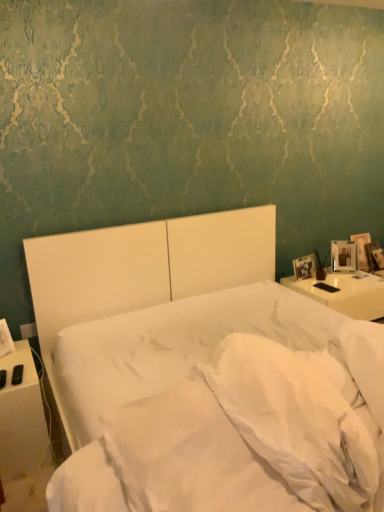
Question: Considering the positions of white matte bed at center and white soft pillow at center, marked as the 2th pillow in a right-to-left arrangement, in the image, is white matte bed at center taller or shorter than white soft pillow at center, marked as the 2th pillow in a right-to-left arrangement,?

Choices:
 (A) tall
 (B) short

Answer: (A)

Question: Considering their positions, is white matte bed at center located in front of or behind white soft pillow at center, marked as the 2th pillow in a right-to-left arrangement?

Choices:
 (A) behind
 (B) front

Answer: (B)

Question: Estimate the real-world distances between objects in this image. Which object is closer to the white plastic remote at left, the first nightstand from the left?

Choices:
 (A) white soft pillow at lower right, arranged as the second pillow when viewed from the left
 (B) white soft pillow at center, marked as the 2th pillow in a right-to-left arrangement
 (C) white glossy nightstand at right, placed as the 2th nightstand when sorted from left to right
 (D) white matte bed at center

Answer: (D)

Question: Based on their relative distances, which object is nearer to the white plastic remote at left, positioned as the 1th nightstand in front-to-back order?

Choices:
 (A) white soft pillow at center, marked as the first pillow in a left-to-right arrangement
 (B) white glossy nightstand at right, placed as the 2th nightstand when sorted from left to right
 (C) white soft pillow at lower right, which is the first pillow in right-to-left order
 (D) white matte bed at center

Answer: (D)